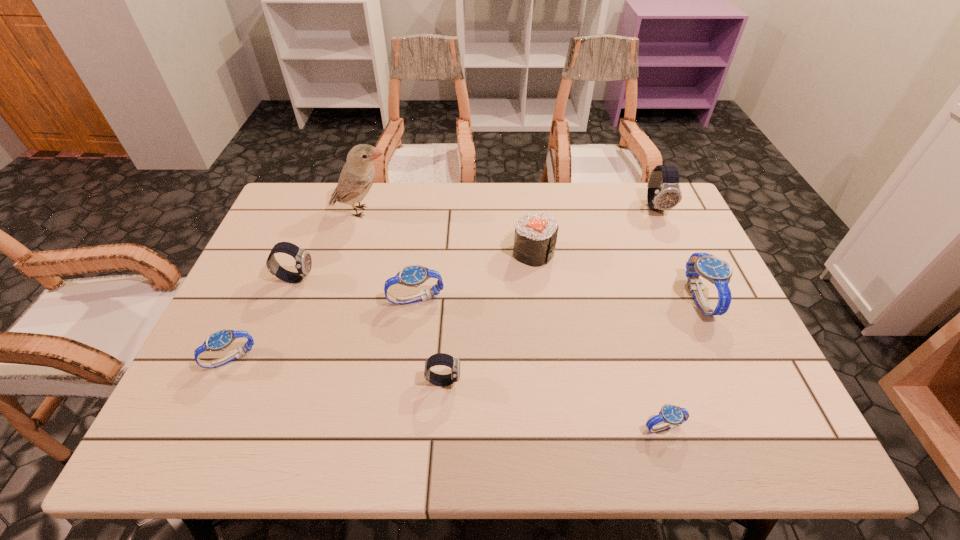
The height and width of the screenshot is (540, 960). What are the coordinates of `dark watch that is the nearest to the second nearest blue watch` in the screenshot? It's located at (303, 259).

Image resolution: width=960 pixels, height=540 pixels. I want to click on dark watch identified as the third closest to the tallest object, so click(x=663, y=193).

Select which blue watch is the third closest to the second shortest watch. Please provide its 2D coordinates. Your answer should be formatted as a tuple, i.e. [(x, y)], where the tuple contains the x and y coordinates of a point satisfying the conditions above.

[(717, 271)]

Find the location of a particular element. The width and height of the screenshot is (960, 540). blue watch identified as the second closest to the second biggest dark watch is located at coordinates (413, 275).

In order to click on vacant region that satisfies the following two spatial constraints: 1. on the front side of the sixth object from left to right; 2. on the face of the smallest dark watch in this screenshot , I will do click(549, 381).

Locate an element on the screen. vacant space that satisfies the following two spatial constraints: 1. at the face of the third farthest object; 2. on the right side of the white bird is located at coordinates (350, 252).

You are a GUI agent. You are given a task and a screenshot of the screen. Output one action in this format:
    pyautogui.click(x=<x>, y=<y>)
    Task: Click on the vacant space that satisfies the following two spatial constraints: 1. on the face of the second nearest dark watch; 2. on the left side of the seventh object from left to right
    Image resolution: width=960 pixels, height=540 pixels.
    Given the screenshot: What is the action you would take?
    pyautogui.click(x=236, y=427)

Find the location of a particular element. The image size is (960, 540). free space that satisfies the following two spatial constraints: 1. at the face of the third farthest object; 2. on the right side of the bird is located at coordinates tap(350, 252).

You are a GUI agent. You are given a task and a screenshot of the screen. Output one action in this format:
    pyautogui.click(x=<x>, y=<y>)
    Task: Click on the blank area in the image that satisfies the following two spatial constraints: 1. on the back side of the rightmost blue watch; 2. on the face of the leftmost dark watch
    This screenshot has width=960, height=540.
    Given the screenshot: What is the action you would take?
    pyautogui.click(x=691, y=278)